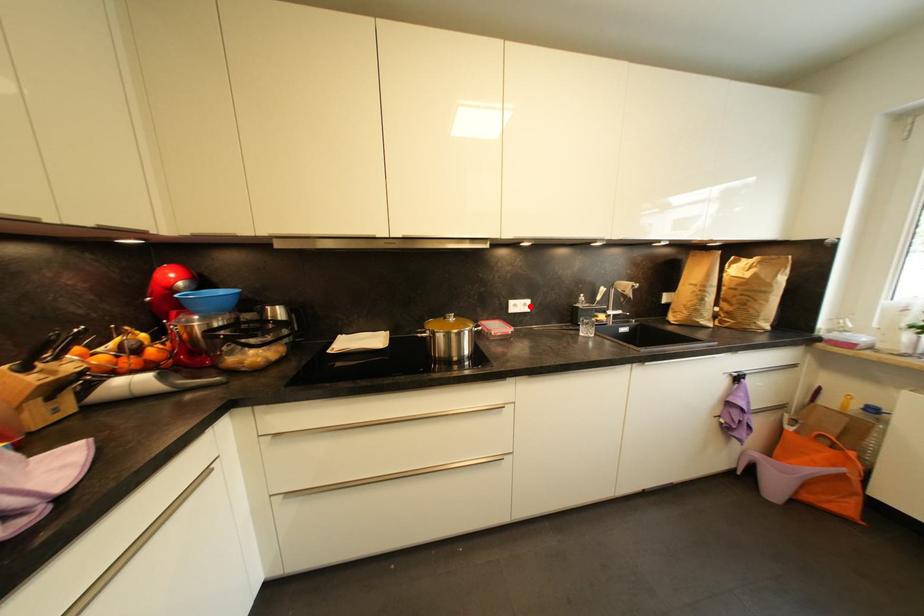
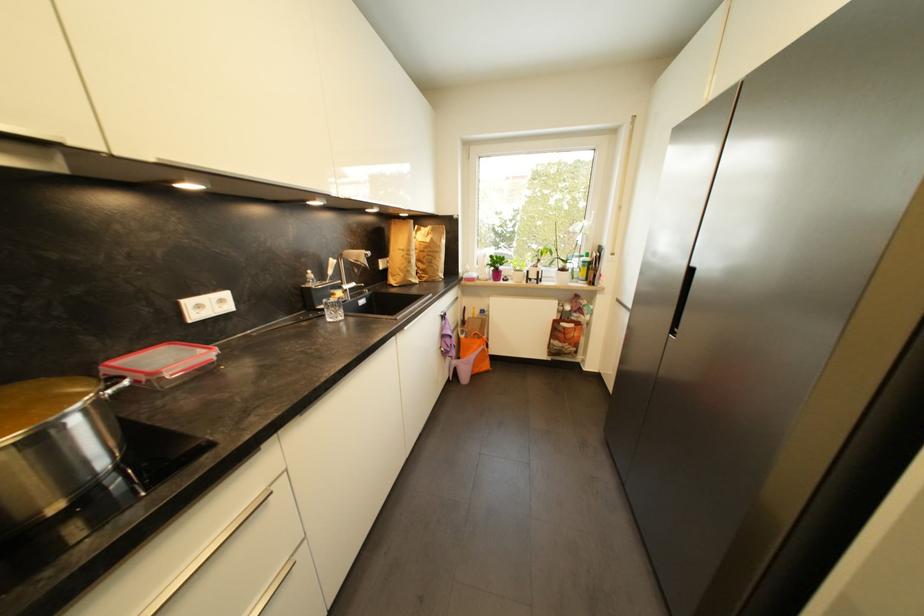
Question: I am providing you with two images of the same scene from different viewpoints. A red point is marked on the first image. Is the red point's position out of view in image 2?

Choices:
 (A) Yes
 (B) No

Answer: (B)